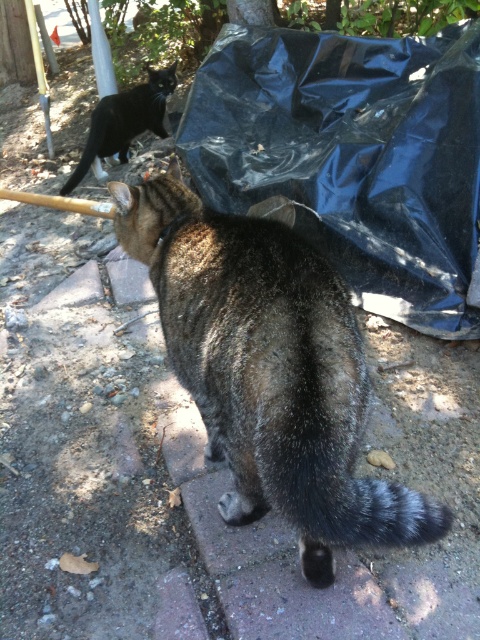
Between black plastic bag at upper right and tabby fur cat at center, which one appears on the right side from the viewer's perspective?

Positioned to the right is black plastic bag at upper right.

Is black plastic bag at upper right below tabby fur cat at center?

No, black plastic bag at upper right is not below tabby fur cat at center.

Does point (299, 195) lie behind point (204, 406)?

Yes, it is behind point (204, 406).

Find the location of a particular element. The width and height of the screenshot is (480, 640). black plastic bag at upper right is located at coordinates (352, 156).

Between tabby fur cat at center and black fur cat at upper left, which one has less height?

black fur cat at upper left is shorter.

Can you confirm if tabby fur cat at center is smaller than black fur cat at upper left?

Incorrect, tabby fur cat at center is not smaller in size than black fur cat at upper left.

Which is behind, point (309, 253) or point (74, 186)?

The point (74, 186) is more distant.

The width and height of the screenshot is (480, 640). What are the coordinates of `tabby fur cat at center` in the screenshot? It's located at (268, 369).

Who is more forward, (359, 170) or (128, 125)?

Point (359, 170) is in front.

Describe the element at coordinates (352, 156) in the screenshot. I see `black plastic bag at upper right` at that location.

Find the location of a particular element. Image resolution: width=480 pixels, height=640 pixels. black plastic bag at upper right is located at coordinates (352, 156).